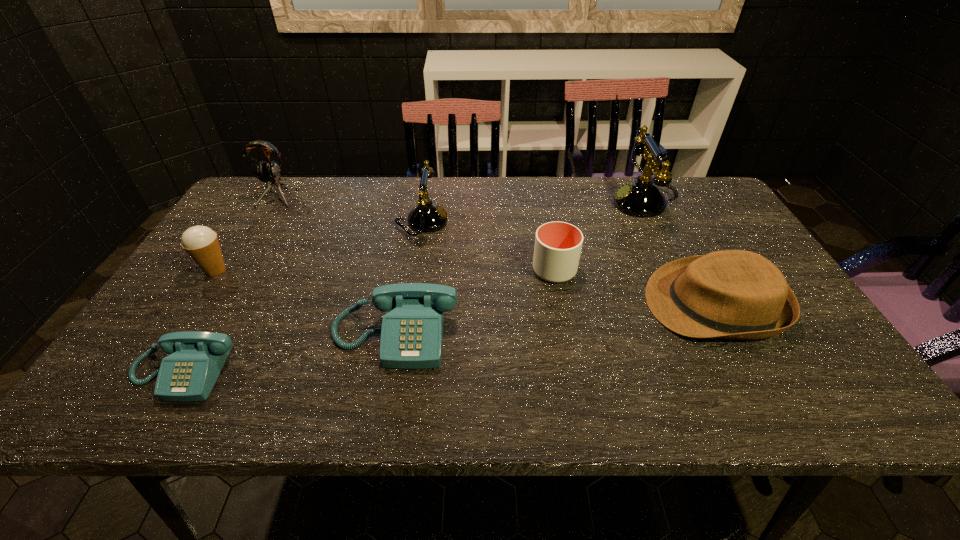
Locate an element on the screen. The image size is (960, 540). the right black telephone is located at coordinates (641, 198).

Locate an element on the screen. This screenshot has height=540, width=960. the bigger black telephone is located at coordinates (641, 198).

This screenshot has width=960, height=540. I want to click on earphone, so click(x=266, y=172).

Image resolution: width=960 pixels, height=540 pixels. I want to click on the smaller black telephone, so click(427, 217).

Image resolution: width=960 pixels, height=540 pixels. I want to click on the third shortest telephone, so click(427, 217).

Where is `icecream`? icecream is located at coordinates pyautogui.click(x=201, y=243).

Locate an element on the screen. The image size is (960, 540). cup is located at coordinates (557, 249).

The height and width of the screenshot is (540, 960). I want to click on the sixth object from left to right, so click(557, 249).

Locate an element on the screen. The image size is (960, 540). brown fedora is located at coordinates (731, 294).

In order to click on the third tallest telephone in this screenshot , I will do `click(412, 331)`.